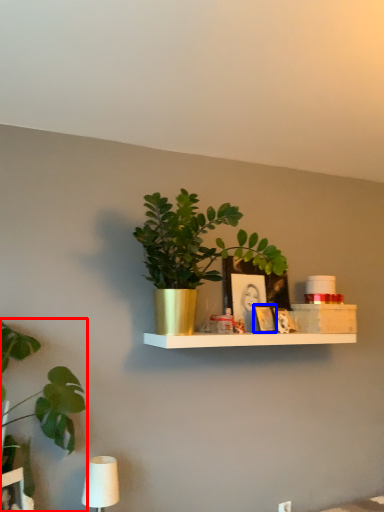
Question: Which object appears farthest to the camera in this image, houseplant (highlighted by a red box) or picture frame (highlighted by a blue box)?

Choices:
 (A) houseplant
 (B) picture frame

Answer: (B)